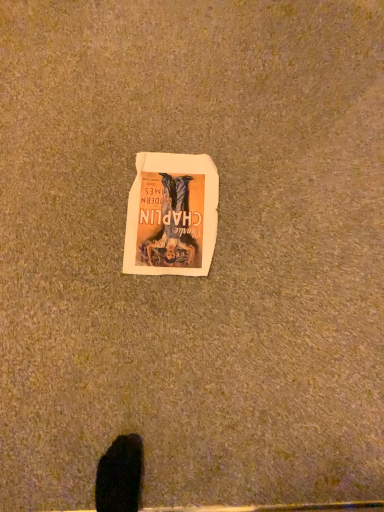
I want to click on unoccupied space behind matte paper poster at center, so click(180, 120).